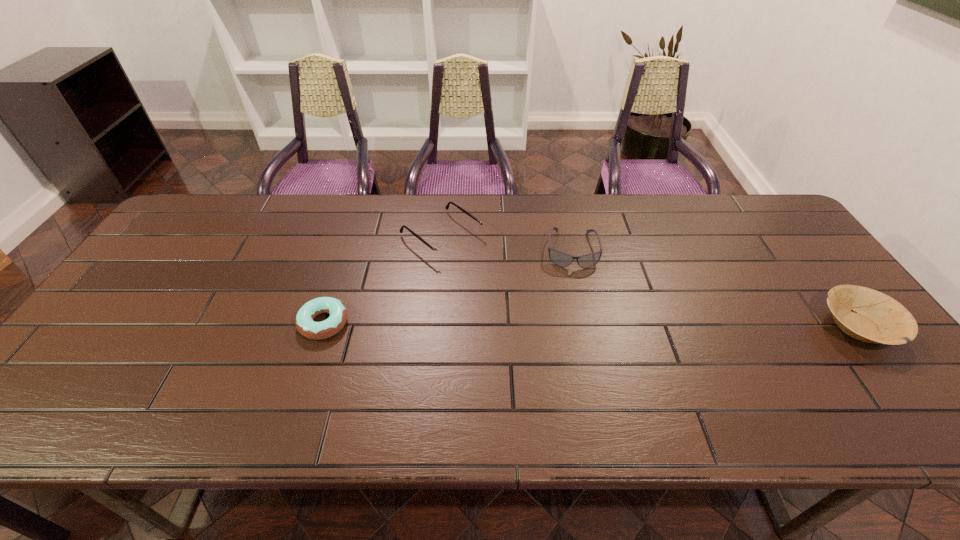
Find the location of a particular element. doughnut is located at coordinates (304, 322).

I want to click on the leftmost object, so click(x=304, y=322).

Where is `the rightmost object`? the rightmost object is located at coordinates (876, 318).

Find the location of a particular element. spectacles is located at coordinates (443, 251).

Find the location of `the second object from right to left`. the second object from right to left is located at coordinates (559, 258).

I want to click on free space located on the left of the shortest object, so click(x=160, y=323).

Find the location of a particular element. vacant point located on the back of the rightmost object is located at coordinates (771, 214).

Where is `free spot located at the hinge ends of the spectacles`? Image resolution: width=960 pixels, height=540 pixels. free spot located at the hinge ends of the spectacles is located at coordinates (526, 301).

You are a GUI agent. You are given a task and a screenshot of the screen. Output one action in this format:
    pyautogui.click(x=<x>, y=<y>)
    Task: Click on the free region located at the hinge ends of the spectacles
    This screenshot has height=540, width=960.
    Given the screenshot: What is the action you would take?
    pyautogui.click(x=540, y=312)

The image size is (960, 540). I want to click on vacant space situated 0.340m at the hinge ends of the spectacles, so click(x=559, y=325).